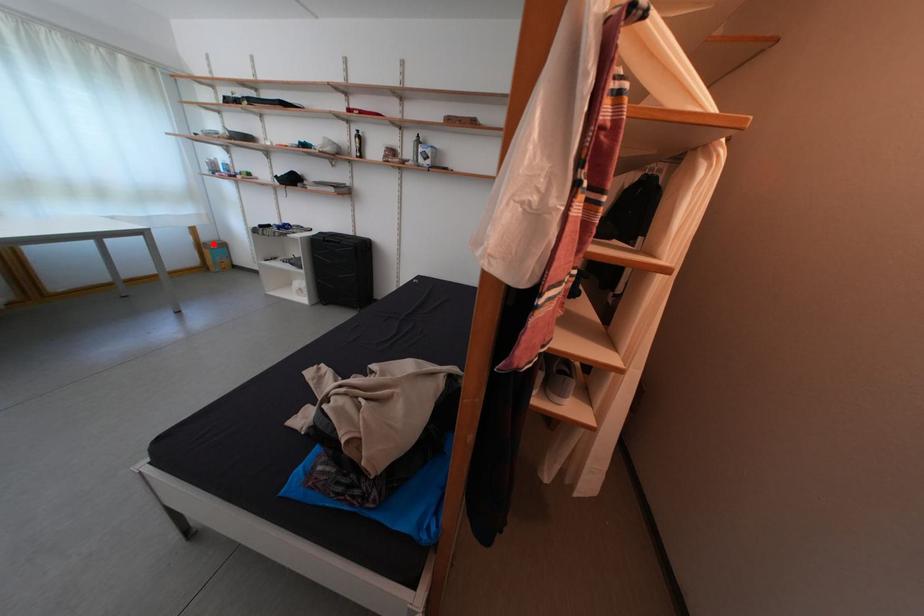
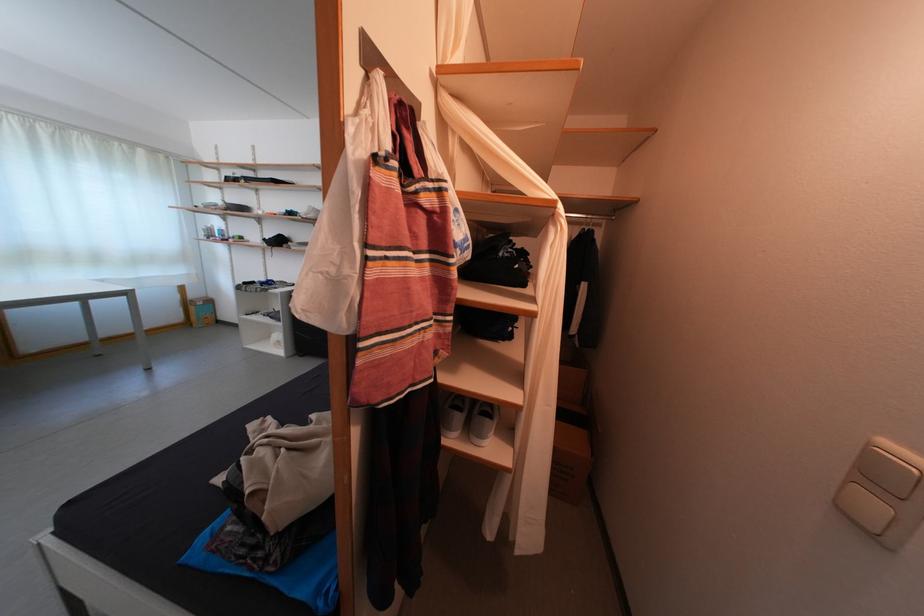
In the second image, find the point that corresponds to the highlighted location in the first image.

(201, 302)